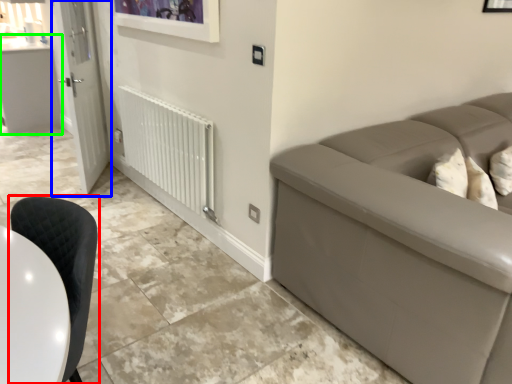
Question: Which object is positioned closest to chair (highlighted by a red box)? Select from door (highlighted by a blue box) and counter top (highlighted by a green box).

Choices:
 (A) door
 (B) counter top

Answer: (A)